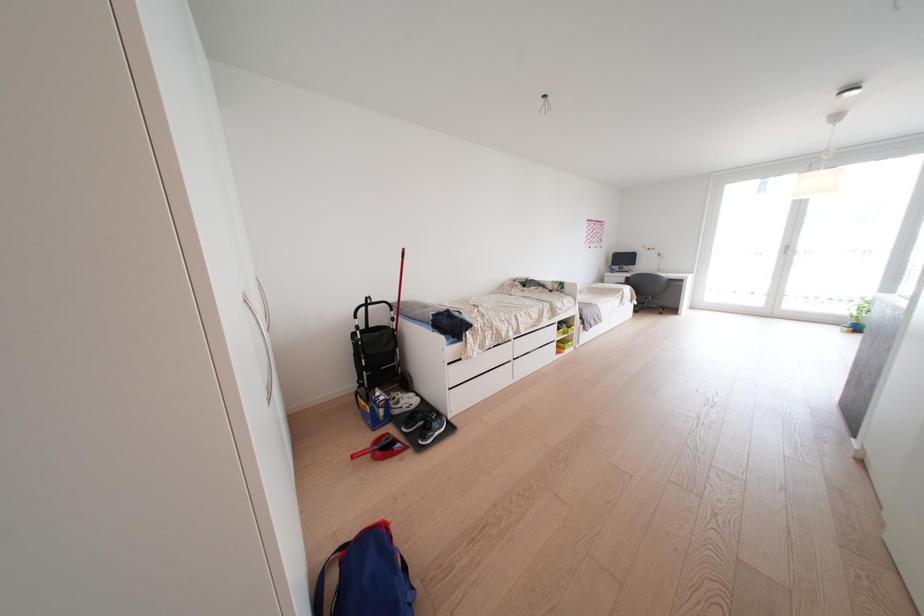
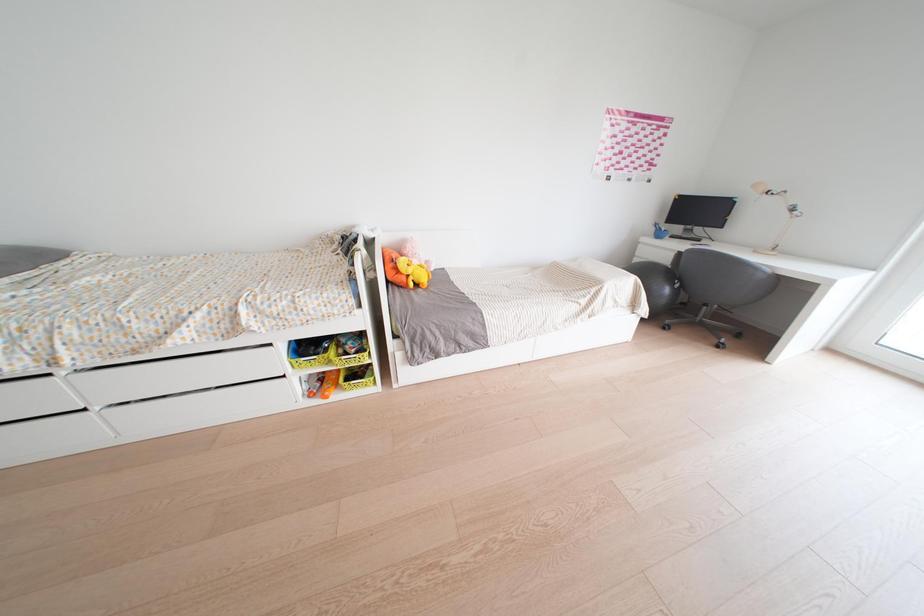
What movement of the cameraman would produce the second image?

The movement direction of the cameraman is right, forward.